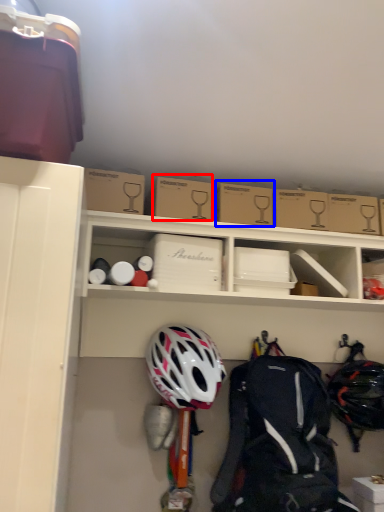
Question: Among these objects, which one is farthest to the camera, cardboard box (highlighted by a red box) or cardboard box (highlighted by a blue box)?

Choices:
 (A) cardboard box
 (B) cardboard box

Answer: (B)